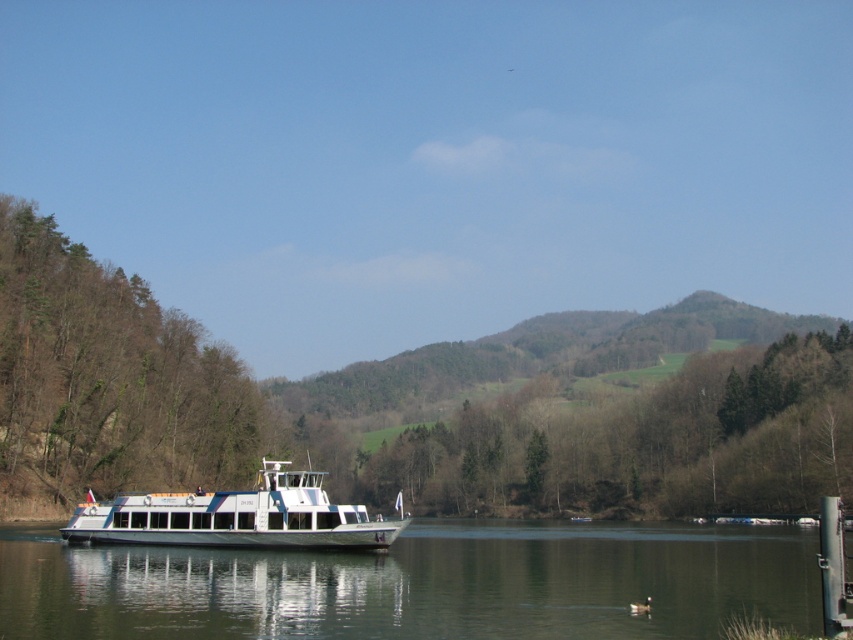
In the scene shown: You are an observer standing on the white passenger ferry boat in the foreground. You notice two green leafy trees on the hillside. Which tree, the green leafy tree at center or the green leafy tree at left, appears bigger in the scene?

The green leafy tree at center appears bigger in the scene compared to the green leafy tree at left because it has a larger size.

You are standing on the white passenger ferry boat in the foreground and looking towards the green leafy tree at center and the green leafy tree at left. Which tree appears taller from your current position?

The green leafy tree at center appears taller than the green leafy tree at left because it has a greater height compared to the green leafy tree at left.

You are standing at the point with coordinates point [119,636] and want to walk to the point with coordinates point [44,404]. Which direction should you move to get closer to your destination?

You should move backward because point [119,636] is in front of point [44,404].